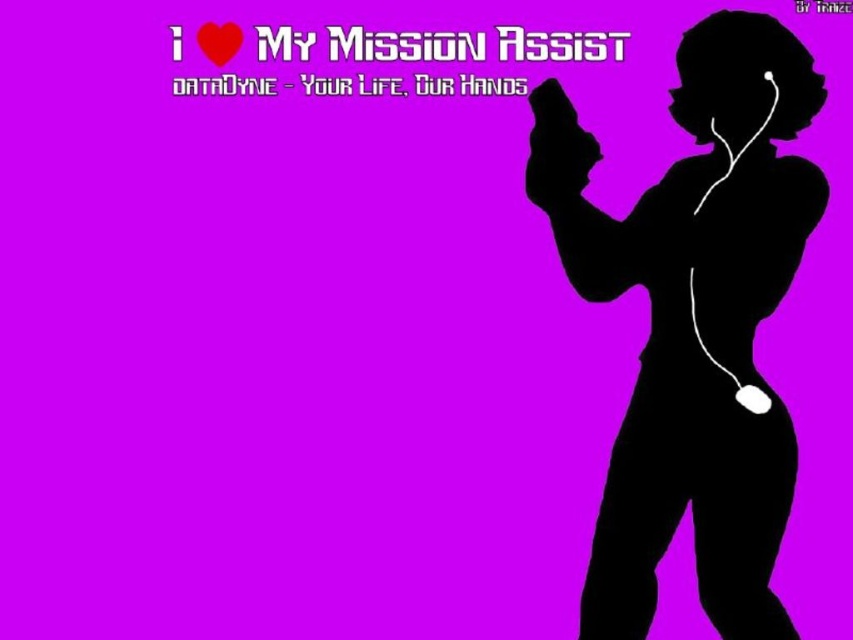
You are designing a poster and need to ensure proper alignment between the black silhouette at right and the red matte heart at upper left. Based on the scene, which object is positioned higher on the poster?

The red matte heart at upper left is positioned higher on the poster than the black silhouette at right.

You are designing a poster and need to ensure proper alignment. The poster has the black silhouette at right and the red matte heart at upper left. Which object is positioned further to the right in the scene?

The black silhouette at right is positioned further to the right than the red matte heart at upper left.

You are designing a poster and need to ensure the black silhouette at right and the red matte heart at upper left are visible. Considering their sizes, which object should you adjust to make them appear more balanced?

The black silhouette at right is larger than the red matte heart at upper left. To balance them, you should reduce the size of the black silhouette at right or increase the size of the red matte heart at upper left.